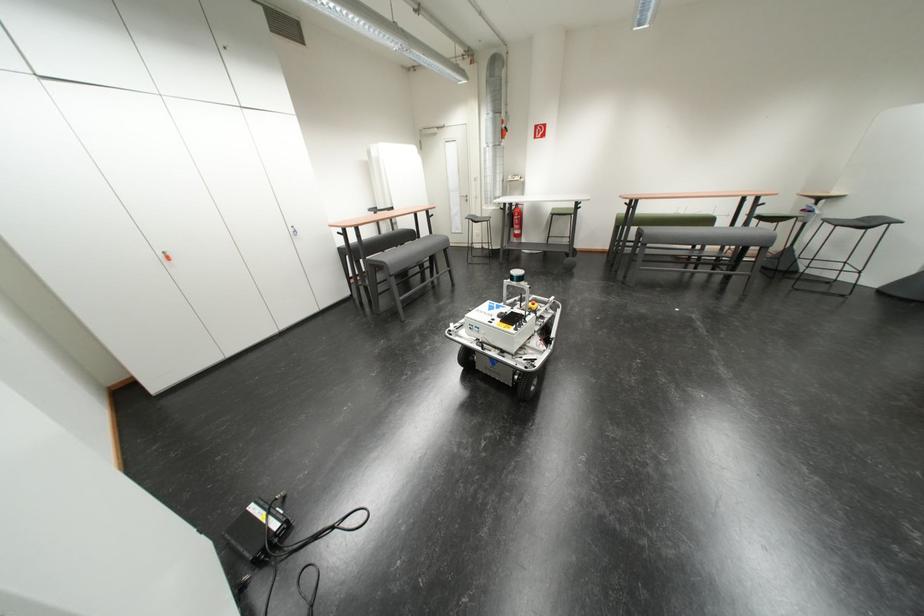
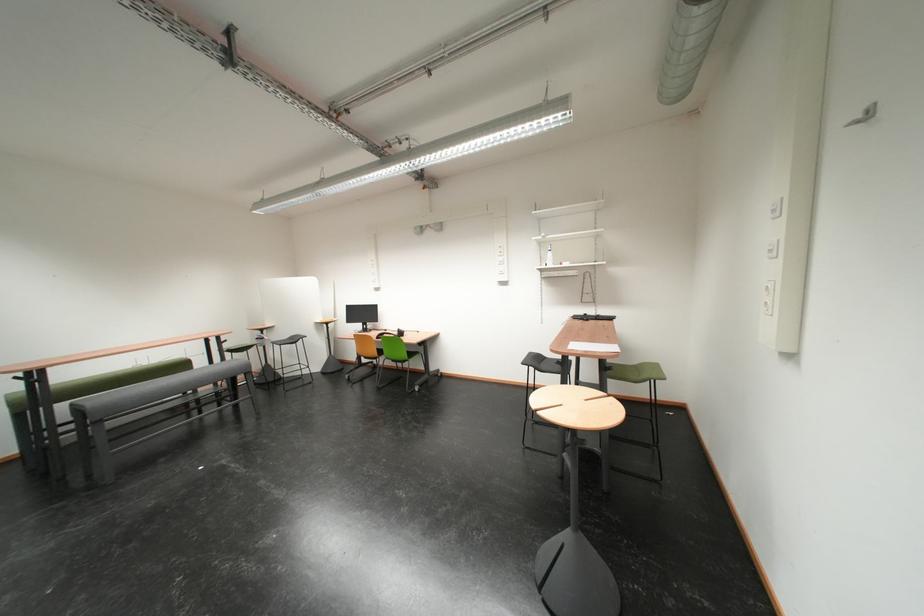
Question: Based on the continuous images, in which direction is the camera rotating? Reply with the corresponding letter.

Choices:
 (A) Left
 (B) Right
 (C) Up
 (D) Down

Answer: (B)